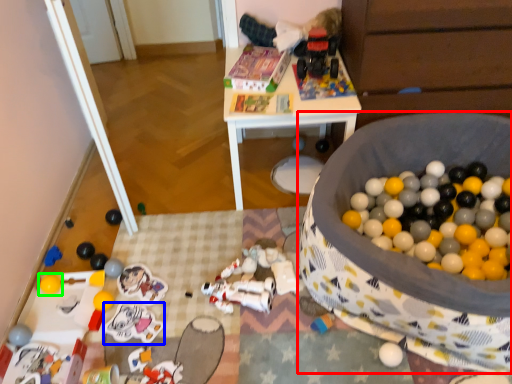
Question: Which object is the closest to the toy (highlighted by a red box)? Choose among these: toy (highlighted by a blue box) or toy (highlighted by a green box).

Choices:
 (A) toy
 (B) toy

Answer: (A)